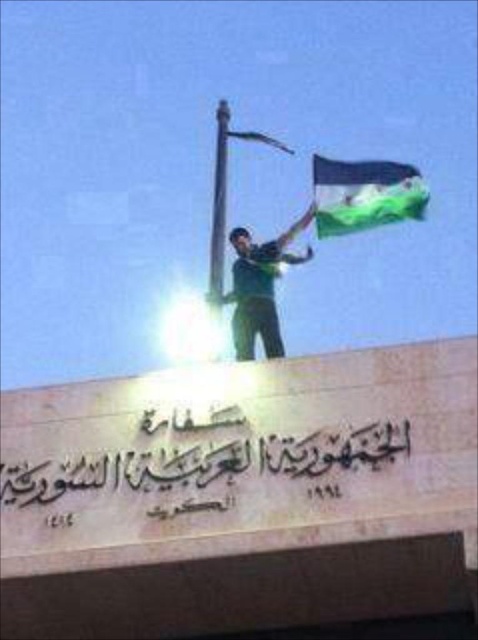
Is green fabric flag at upper right thinner than green matte shirt at center?

Incorrect, green fabric flag at upper right's width is not less than green matte shirt at center's.

How much distance is there between green fabric flag at upper right and green matte shirt at center?

green fabric flag at upper right and green matte shirt at center are 8.22 meters apart from each other.

The height and width of the screenshot is (640, 478). Find the location of `green fabric flag at upper right`. green fabric flag at upper right is located at coordinates (365, 195).

Does beige stone inscription at center appear under green matte shirt at center?

Correct, beige stone inscription at center is located below green matte shirt at center.

From the picture: Which is more to the left, beige stone inscription at center or green matte shirt at center?

beige stone inscription at center is more to the left.

The height and width of the screenshot is (640, 478). I want to click on beige stone inscription at center, so [205, 461].

The width and height of the screenshot is (478, 640). In order to click on beige stone inscription at center in this screenshot , I will do `click(205, 461)`.

Which is more to the right, beige stone inscription at center or green fabric flag at upper right?

green fabric flag at upper right is more to the right.

Does beige stone inscription at center appear under green fabric flag at upper right?

Correct, beige stone inscription at center is located below green fabric flag at upper right.

Who is more forward, (147, 499) or (367, 177)?

Point (147, 499)

In order to click on beige stone inscription at center in this screenshot , I will do `click(205, 461)`.